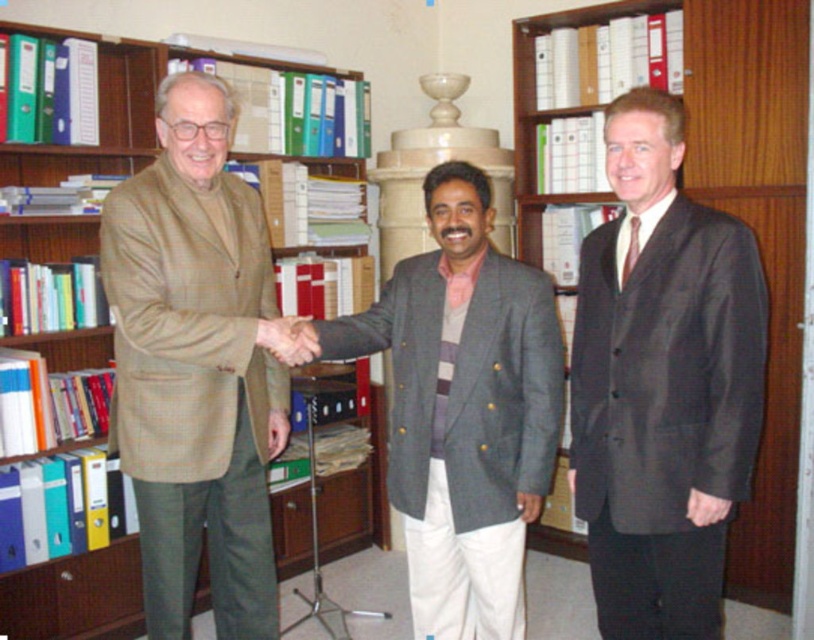
You are a tailor measuring the distance between two items to ensure proper fitting. The beige woolen coat at left needs to be displayed next to the brown leather hand at center in a store window. Given that the display shelf is 14 inches wide, will both items fit side by side without overlapping?

The distance between the beige woolen coat at left and brown leather hand at center is 12.16 inches. Since the display shelf is 14 inches wide, which is wider than the required space, both items can fit side by side without overlapping.

You are standing in the office and need to find the dark gray suit at center. According to the coordinates provided, where exactly should you look?

The dark gray suit at center is located at point (x=662, y=384), so you should look there.

What is the exact location of the beige woolen coat at left in the image?

The beige woolen coat at left is located at point (195, 368).